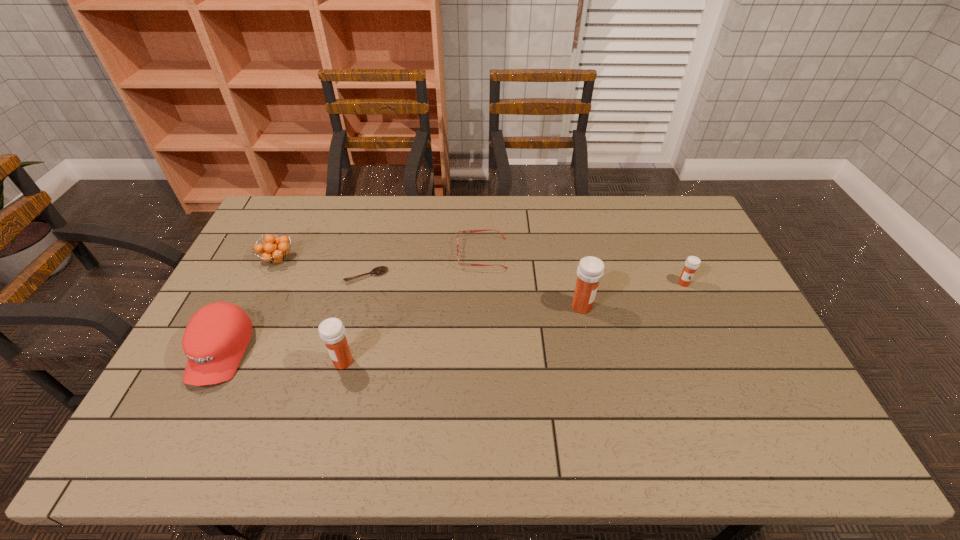
In the image, there is a desktop. Identify the location of vacant space at the far left corner. (304, 225).

Where is `vacant region at the near left corner of the desktop`? vacant region at the near left corner of the desktop is located at coordinates (190, 386).

Where is `empty space between the orange fruit and the leftmost medicine`? empty space between the orange fruit and the leftmost medicine is located at coordinates (310, 310).

This screenshot has height=540, width=960. Find the location of `free spot between the second nearest medicine and the orange fruit`. free spot between the second nearest medicine and the orange fruit is located at coordinates (430, 283).

The image size is (960, 540). I want to click on empty space that is in between the second nearest medicine and the cap, so click(x=401, y=329).

Image resolution: width=960 pixels, height=540 pixels. I want to click on free space between the second medicine from left to right and the orange fruit, so click(x=430, y=283).

Locate an element on the screen. blank region between the shortest object and the cap is located at coordinates (294, 314).

The image size is (960, 540). Identify the location of vacant area between the second tallest object and the shortest object. (355, 319).

Locate an element on the screen. This screenshot has width=960, height=540. empty space between the nearest medicine and the shortest medicine is located at coordinates tap(514, 322).

Where is `free space that is in between the sixth shortest object and the shortest object`? free space that is in between the sixth shortest object and the shortest object is located at coordinates (355, 319).